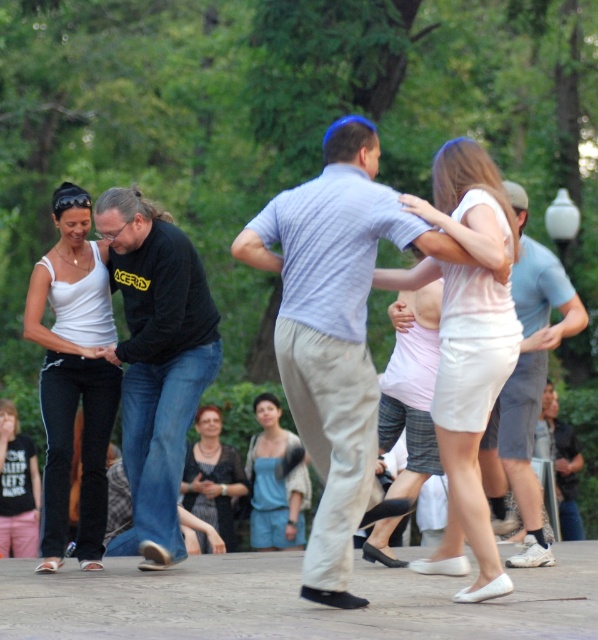
Can you confirm if black cotton shirt at center is positioned below matte black tank top at lower left?

No.

The width and height of the screenshot is (598, 640). What are the coordinates of `black cotton shirt at center` in the screenshot? It's located at (157, 358).

Identify the location of black cotton shirt at center. The width and height of the screenshot is (598, 640). (157, 358).

Can you confirm if light blue striped shirt at center is smaller than black cotton shirt at center?

No.

Who is more distant from viewer, (329, 266) or (212, 316)?

Positioned behind is point (212, 316).

Does point (285, 289) come closer to viewer compared to point (160, 456)?

Yes, point (285, 289) is closer to viewer.

Locate an element on the screen. The width and height of the screenshot is (598, 640). light blue striped shirt at center is located at coordinates (334, 330).

Can you confirm if denim dress at center is positioned to the right of matte black dress at center?

Yes, denim dress at center is to the right of matte black dress at center.

Is denim dress at center smaller than matte black dress at center?

Actually, denim dress at center might be larger than matte black dress at center.

Does point (276, 484) come farther from viewer compared to point (209, 444)?

Yes, it is behind point (209, 444).

Locate an element on the screen. The width and height of the screenshot is (598, 640). denim dress at center is located at coordinates (276, 481).